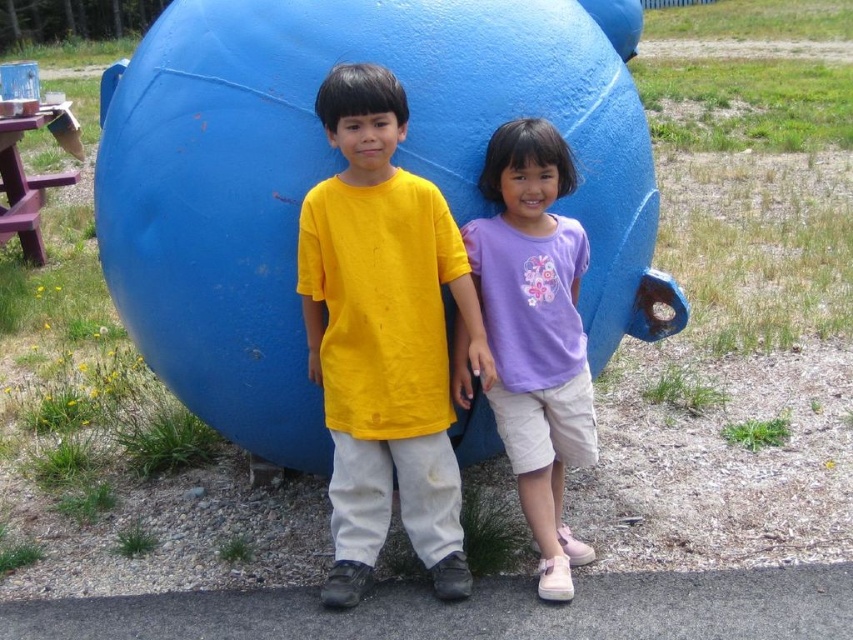
Question: Which object appears closest to the camera in this image?

Choices:
 (A) purple cotton shirt at center
 (B) purple wood picnic table at left
 (C) yellow cotton shirt at center
 (D) blue matte ball at center

Answer: (C)

Question: Among these objects, which one is nearest to the camera?

Choices:
 (A) purple wood picnic table at left
 (B) purple cotton shirt at center

Answer: (B)

Question: Is blue matte ball at center above yellow cotton shirt at center?

Choices:
 (A) no
 (B) yes

Answer: (B)

Question: From the image, what is the correct spatial relationship of blue matte ball at center in relation to yellow cotton shirt at center?

Choices:
 (A) right
 (B) left

Answer: (B)

Question: Which point is farther to the camera?

Choices:
 (A) (604, 189)
 (B) (21, 225)
 (C) (490, 253)

Answer: (B)

Question: Is purple cotton shirt at center below purple wood picnic table at left?

Choices:
 (A) no
 (B) yes

Answer: (B)